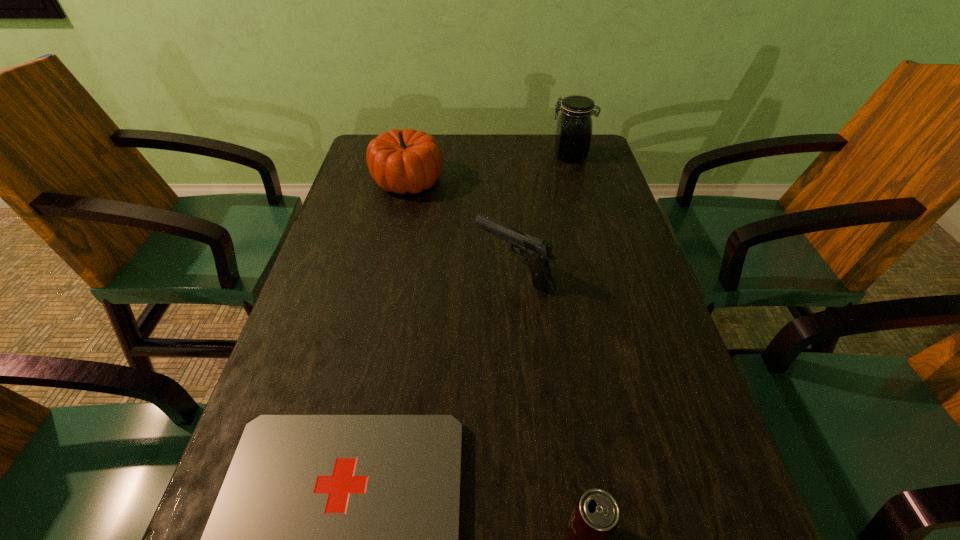
The height and width of the screenshot is (540, 960). I want to click on the rightmost object, so click(573, 136).

I want to click on jar, so click(573, 136).

You are a GUI agent. You are given a task and a screenshot of the screen. Output one action in this format:
    pyautogui.click(x=<x>, y=<y>)
    Task: Click on the pumpkin
    The width and height of the screenshot is (960, 540).
    Given the screenshot: What is the action you would take?
    pyautogui.click(x=400, y=161)

Where is `gun`? Image resolution: width=960 pixels, height=540 pixels. gun is located at coordinates (537, 253).

Identify the location of vacant space positioned 0.350m on the lid of the tallest object. Image resolution: width=960 pixels, height=540 pixels. (437, 156).

Identify the location of vacant space positioned 0.400m on the lid of the tallest object. This screenshot has width=960, height=540. (420, 156).

Find the location of `vacant region located on the lid of the tallest object`. vacant region located on the lid of the tallest object is located at coordinates (468, 156).

I want to click on vacant space located on the right of the pumpkin, so click(x=499, y=180).

The width and height of the screenshot is (960, 540). In order to click on vacant space located at the muzzle of the third farthest object in this screenshot , I will do `click(436, 274)`.

Find the location of a particular element. free space located 0.260m at the muzzle of the third farthest object is located at coordinates (361, 274).